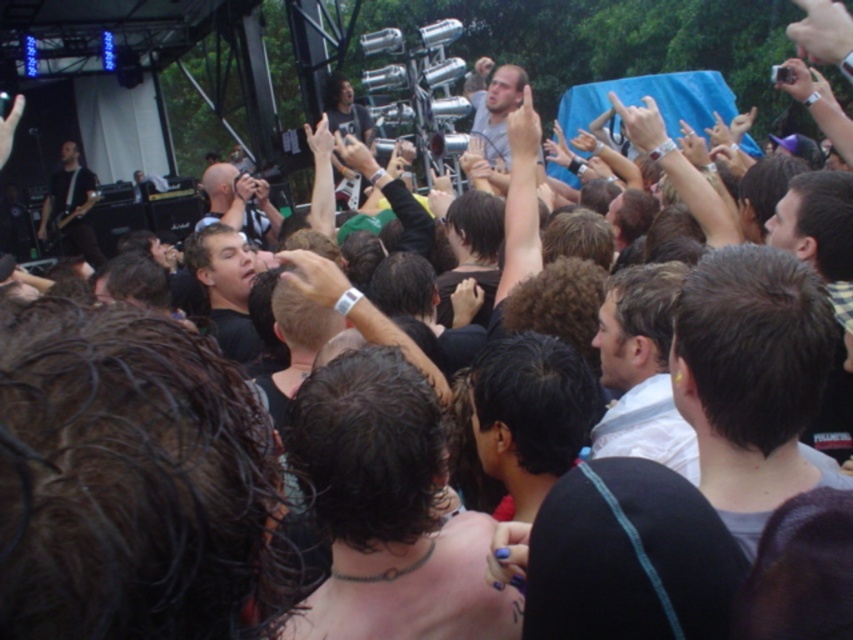
In the concert scene, there is a person with dark brown hair located at point (387,509). If you were standing at the center of the image, would this person be to your left or right?

The dark brown hair at center is located at point (387,509), which is to the right of the center point. Therefore, the person would be to your right.

You are a photographer at the concert. You want to take a photo of the black shirt at center and the black leather guitar at left. Which object should you focus on first if you want to capture both in the same frame without moving the camera?

The black shirt at center is positioned under the black leather guitar at left, so you should focus on the black leather guitar at left first to ensure both are in the frame.